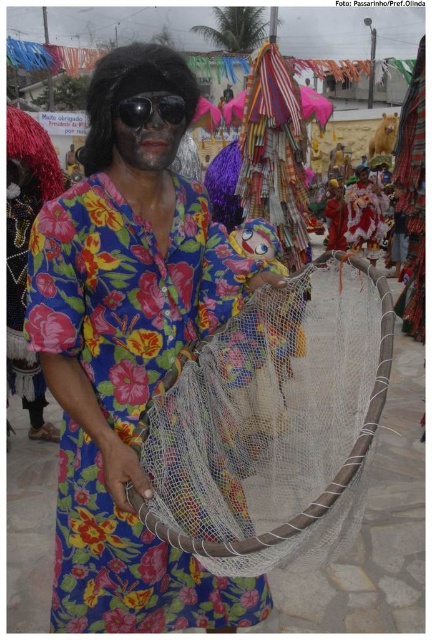
You are a photographer at the carnival. You want to take a photo that includes both the floral fabric dress at center and the black synthetic wig at upper left. However, you can only focus on one object at a time. Which object should you focus on to ensure the other is still visible in the background?

You should focus on the floral fabric dress at center because it is in front of the black synthetic wig at upper left, so the black synthetic wig at upper left will be visible in the background.